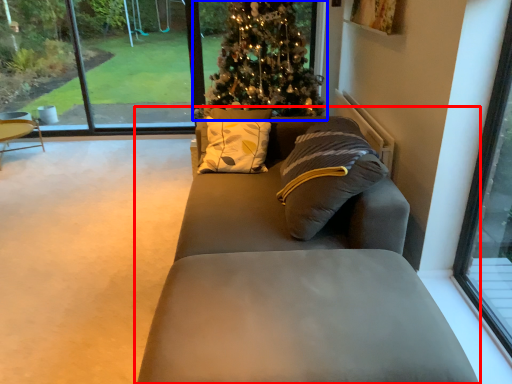
Question: Which of the following is the farthest to the observer, studio couch (highlighted by a red box) or christmas tree (highlighted by a blue box)?

Choices:
 (A) studio couch
 (B) christmas tree

Answer: (B)